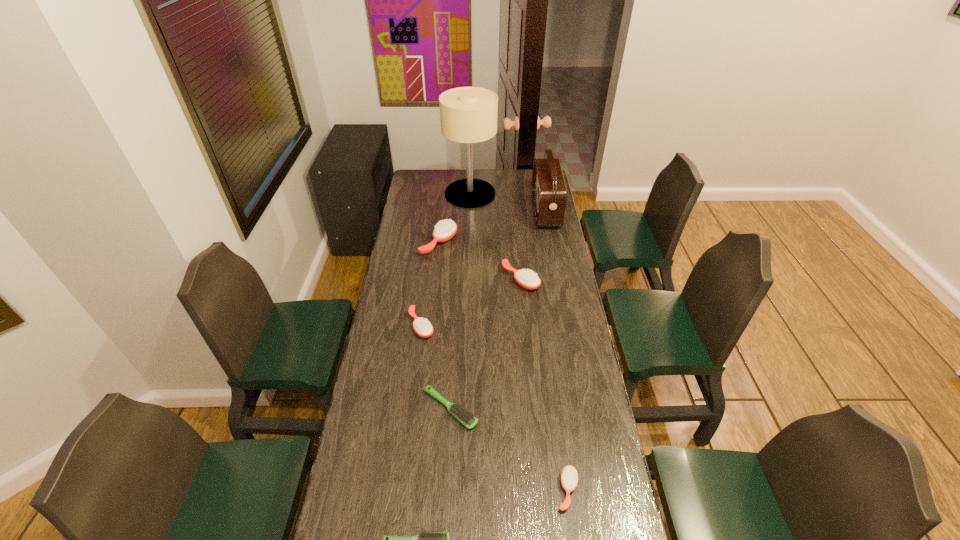
Locate an element on the screen. the bigger light hairbrush is located at coordinates (461, 414).

You are a GUI agent. You are given a task and a screenshot of the screen. Output one action in this format:
    pyautogui.click(x=<x>, y=<y>)
    Task: Click on the seventh farthest object
    
    Given the screenshot: What is the action you would take?
    pyautogui.click(x=569, y=476)

The width and height of the screenshot is (960, 540). I want to click on the smallest orange hairbrush, so click(569, 476).

The width and height of the screenshot is (960, 540). What are the coordinates of `free space located 0.240m on the right of the beige table lamp` in the screenshot? It's located at (538, 194).

Find the location of a particular element. The width and height of the screenshot is (960, 540). vacant space located on the front panel of the second tallest object is located at coordinates coord(483,212).

At what (x,y) coordinates should I click in order to perform the action: click on blank space located 0.370m on the front panel of the second tallest object. Please return your answer as a coordinate pair (x, y). Image resolution: width=960 pixels, height=540 pixels. Looking at the image, I should click on pos(465,212).

This screenshot has height=540, width=960. In order to click on free space located on the front panel of the second tallest object in this screenshot , I will do `click(479, 212)`.

Locate an element on the screen. free space located 0.180m on the right of the farthest hairbrush is located at coordinates (493, 242).

Where is `vacant region located 0.220m on the front of the second biggest orange hairbrush`? vacant region located 0.220m on the front of the second biggest orange hairbrush is located at coordinates (526, 333).

Identify the location of vacant space situated on the back of the third biggest orange hairbrush. This screenshot has height=540, width=960. (430, 252).